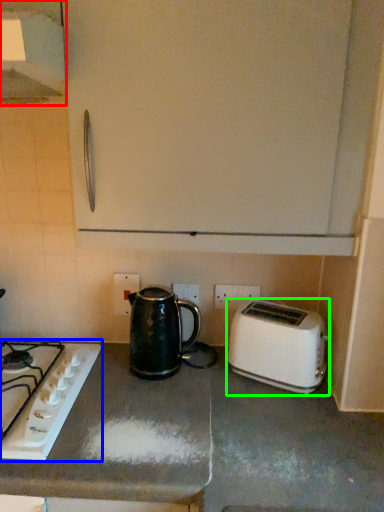
Question: Estimate the real-world distances between objects in this image. Which object is closer to exhaust hood (highlighted by a red box), gas stove (highlighted by a blue box) or toaster (highlighted by a green box)?

Choices:
 (A) gas stove
 (B) toaster

Answer: (A)